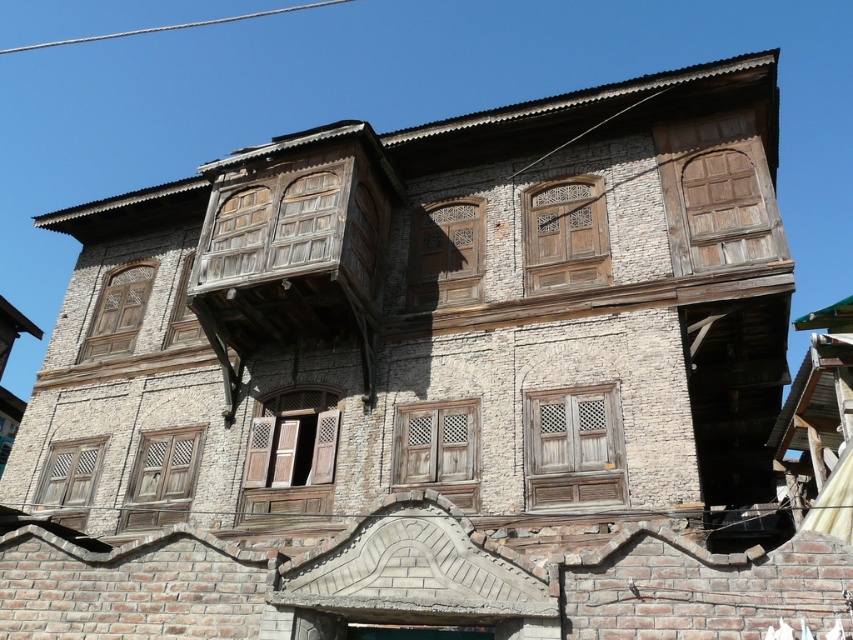
You are an architect examining the building and need to determine the spatial relationship between the wooden at upper right and the wooden lattice window at lower left. Which object is located to the right of the other?

The wooden at upper right is positioned on the right side of the wooden lattice window at lower left.

You are standing in front of the building and notice two points marked on the facade. The first point is at coordinate point (180, 488) and the second is at point (100, 308). Which point is closer to you?

Point (180, 488) is in front of point (100, 308), so the first point is closer to you.

You are a painter standing at the base of the building and want to paint both the wooden lattice window at center and the wooden lattice window at upper left. Given that your ladder can reach up to 3.5 meters, can you paint both windows without moving the ladder?

The wooden lattice window at center is 3.60 meters away from wooden lattice window at upper left. Since the ladder can only reach up to 3.5 meters, you cannot paint both windows without moving the ladder because the distance between them exceeds the ladder height limit.